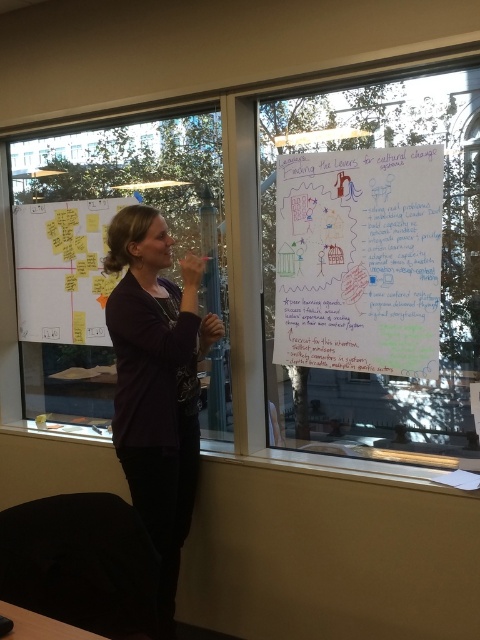
Measure the distance between whiteboard at upper center and camera.

whiteboard at upper center is 2.03 meters from camera.

Does whiteboard at upper center appear on the left side of yellow sticky notes at left?

In fact, whiteboard at upper center is to the right of yellow sticky notes at left.

Measure the distance between point (x=313, y=164) and camera.

A distance of 7.32 feet exists between point (x=313, y=164) and camera.

Identify the location of whiteboard at upper center. This screenshot has height=640, width=480. (359, 259).

You are a GUI agent. You are given a task and a screenshot of the screen. Output one action in this format:
    pyautogui.click(x=<x>, y=<y>)
    Task: Click on the transparent glass window at upper center
    
    Given the screenshot: What is the action you would take?
    pyautogui.click(x=104, y=257)

Between transparent glass window at upper center and yellow sticky notes at left, which one appears on the left side from the viewer's perspective?

From the viewer's perspective, yellow sticky notes at left appears more on the left side.

Which is in front, point (75, 144) or point (98, 260)?

Point (98, 260)

In order to click on transparent glass window at upper center in this screenshot , I will do `click(104, 257)`.

Is point (151, 349) behind point (20, 330)?

No, (151, 349) is in front of (20, 330).

Does matte purple sweater at center have a smaller size compared to yellow sticky notes at left?

No.

Who is more forward, [155,420] or [50,204]?

Point [155,420] is more forward.

The image size is (480, 640). I want to click on matte purple sweater at center, so [156, 384].